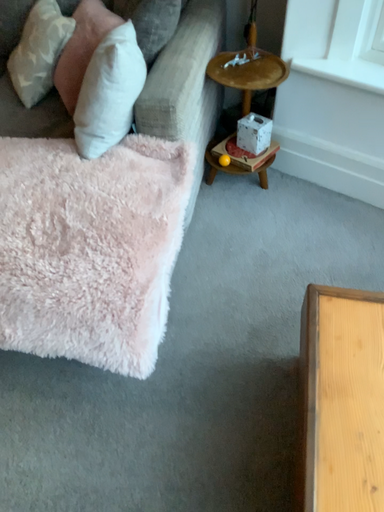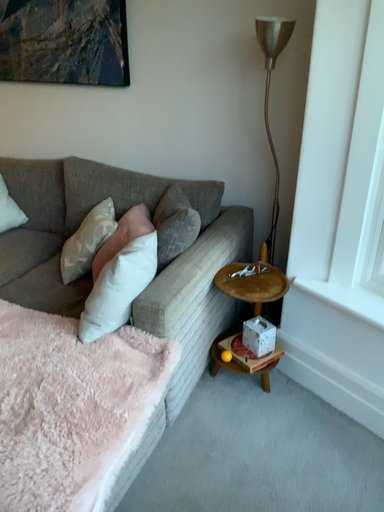
Question: How did the camera likely rotate when shooting the video?

Choices:
 (A) rotated left
 (B) rotated right

Answer: (A)